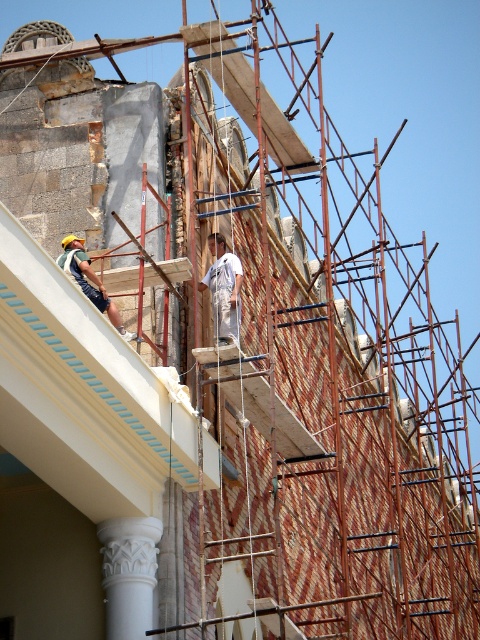
You are a safety inspector assessing the construction site. You notice the white carved column at lower left and the green fabric construction worker at left. Which object is wider? Please base your answer on the spatial details provided in the scene.

The white carved column at lower left is wider than the green fabric construction worker at left according to the description.

You are a construction supervisor checking the alignment of the white carved column at lower left and the white cotton shirt at center. Which object is wider?

The white carved column at lower left is wider than the white cotton shirt at center.

You are a safety inspector observing the construction site. You notice two workers near the building structure. One is wearing a white cotton shirt at center and the other is a green fabric construction worker at left. Based on their heights, which worker might be standing closer to the ground?

The white cotton shirt at center is not as tall as the green fabric construction worker at left, so the worker in the white cotton shirt at center might be standing closer to the ground.